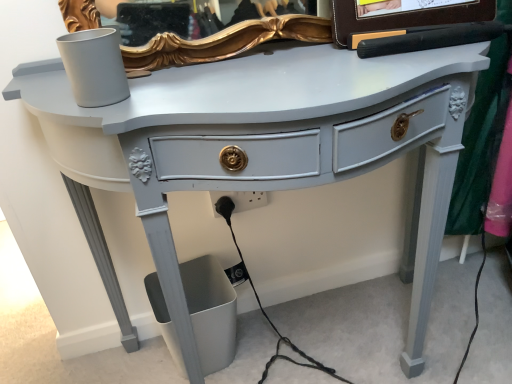
In order to click on black plastic hair straightener at upper right in this screenshot , I will do `click(403, 15)`.

What is the approximate height of black plastic hair straightener at upper right?

black plastic hair straightener at upper right is 1.11 inches in height.

The width and height of the screenshot is (512, 384). What do you see at coordinates (403, 15) in the screenshot?
I see `black plastic hair straightener at upper right` at bounding box center [403, 15].

At what (x,y) coordinates should I click in order to perform the action: click on black plastic hair straightener at upper right. Please return your answer as a coordinate pair (x, y). This screenshot has height=384, width=512. Looking at the image, I should click on (403, 15).